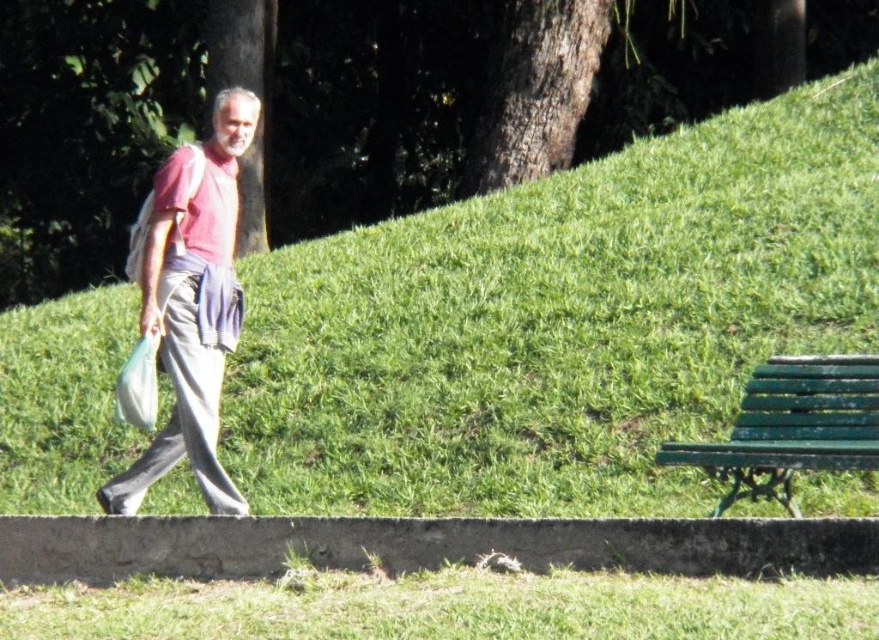
Which is more to the right, green grassy hillside at center or matte red shirt at left?

green grassy hillside at center is more to the right.

Is green grassy hillside at center smaller than matte red shirt at left?

Correct, green grassy hillside at center occupies less space than matte red shirt at left.

Is point (689, 353) positioned in front of point (187, 262)?

No, it is not.

This screenshot has width=879, height=640. Find the location of `green grassy hillside at center`. green grassy hillside at center is located at coordinates (560, 323).

Who is positioned more to the left, green grassy hillside at center or green grassy at lower center?

From the viewer's perspective, green grassy at lower center appears more on the left side.

Is green grassy hillside at center further to camera compared to green grassy at lower center?

That is True.

Does point (692, 323) come closer to viewer compared to point (803, 637)?

No, (692, 323) is behind (803, 637).

Locate an element on the screen. The height and width of the screenshot is (640, 879). green grassy hillside at center is located at coordinates (560, 323).

Is green grassy hillside at center shorter than green painted wood bench at lower right?

Correct, green grassy hillside at center is not as tall as green painted wood bench at lower right.

Is green grassy hillside at center further to camera compared to green painted wood bench at lower right?

Yes, it is.

This screenshot has height=640, width=879. Identify the location of green grassy hillside at center. [x=560, y=323].